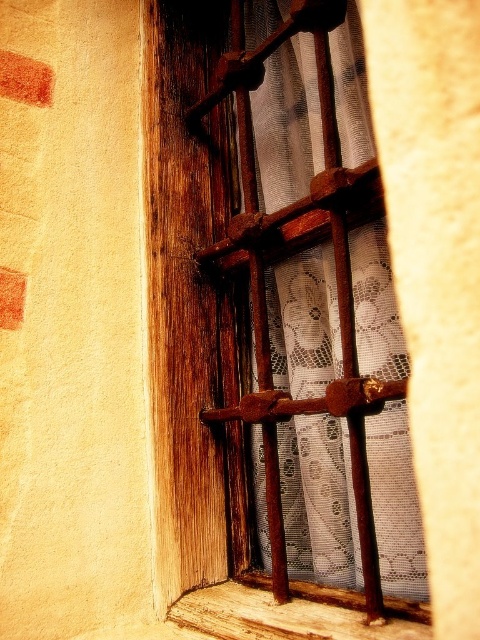
Question: Can you confirm if rustic wood window frame at center is thinner than wooden window sill at lower center?

Choices:
 (A) yes
 (B) no

Answer: (B)

Question: Does rustic wood window frame at center have a lesser width compared to wooden window sill at lower center?

Choices:
 (A) no
 (B) yes

Answer: (A)

Question: Which point is farther to the camera?

Choices:
 (A) (348, 378)
 (B) (360, 605)

Answer: (B)

Question: Where is rustic wood window frame at center located in relation to wooden window sill at lower center in the image?

Choices:
 (A) below
 (B) above

Answer: (B)

Question: Among these objects, which one is farthest from the camera?

Choices:
 (A) wooden window sill at lower center
 (B) rustic wood window frame at center

Answer: (B)

Question: Which point is farther from the camera taking this photo?

Choices:
 (A) (392, 580)
 (B) (249, 616)

Answer: (B)